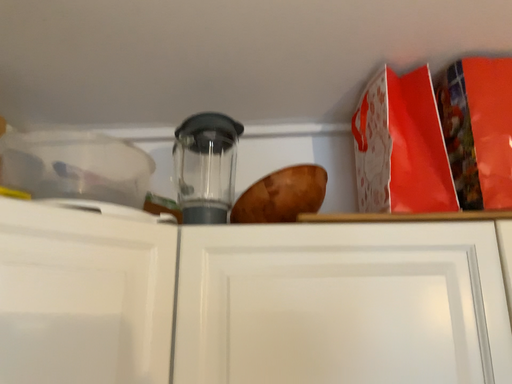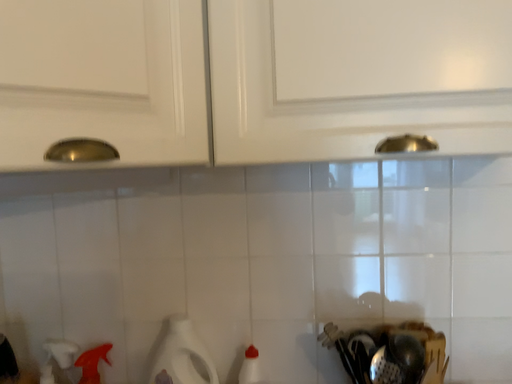
Question: How did the camera likely rotate when shooting the video?

Choices:
 (A) rotated downward
 (B) rotated upward

Answer: (A)